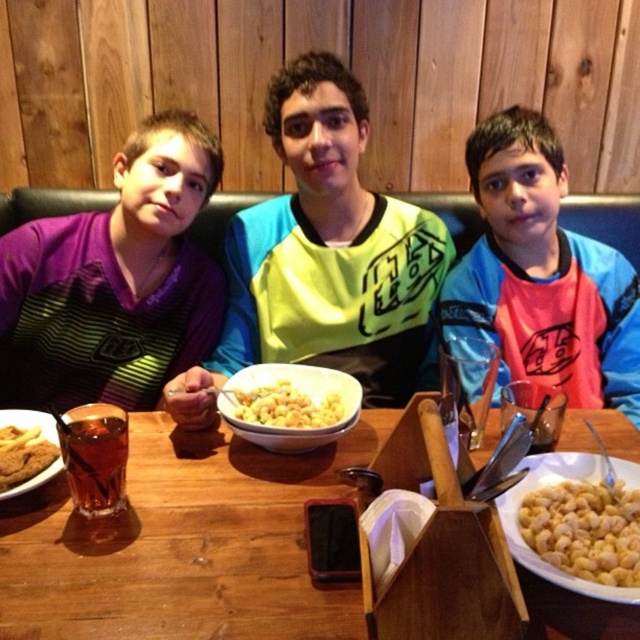
Question: Which is farther from the purple jersey at left?

Choices:
 (A) yellow matte shirt at center
 (B) yellow matte pasta at center
 (C) pink jersey at center
 (D) yellowish matte macaroni at center

Answer: (D)

Question: Can you confirm if wooden table at center is positioned above yellow matte pasta at center?

Choices:
 (A) yes
 (B) no

Answer: (B)

Question: Which of the following is the farthest from the observer?

Choices:
 (A) (563, 179)
 (B) (339, 428)

Answer: (A)

Question: Is yellow matte shirt at center positioned at the back of brown glass at lower left?

Choices:
 (A) no
 (B) yes

Answer: (B)

Question: Can you confirm if yellow matte shirt at center is positioned to the right of yellow matte pasta at center?

Choices:
 (A) no
 (B) yes

Answer: (B)

Question: Which point is farther to the camera?

Choices:
 (A) (356, 410)
 (B) (364, 307)

Answer: (B)